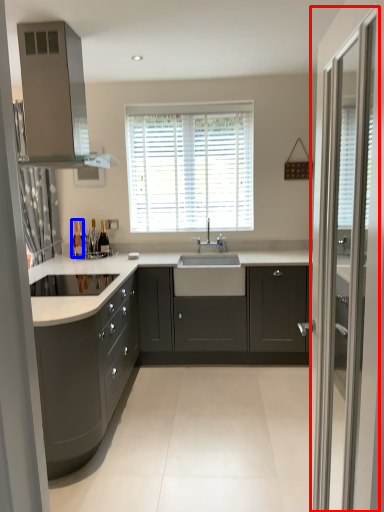
Question: Which point is closer to the camera, screen door (highlighted by a red box) or bottle (highlighted by a blue box)?

Choices:
 (A) screen door
 (B) bottle

Answer: (A)